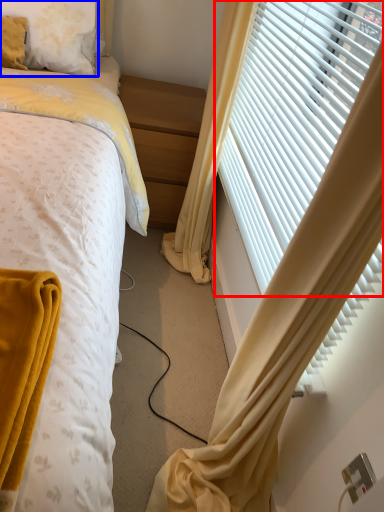
Question: Among these objects, which one is nearest to the camera, window blind (highlighted by a red box) or pillow (highlighted by a blue box)?

Choices:
 (A) window blind
 (B) pillow

Answer: (A)